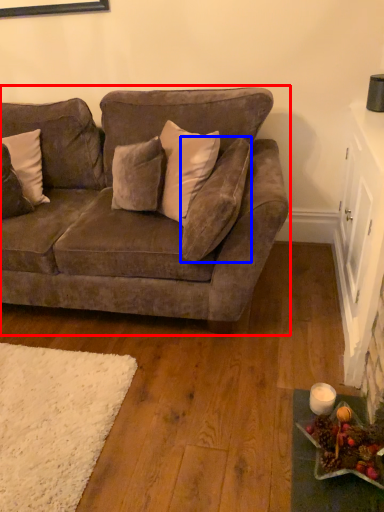
Question: Which of the following is the farthest to the observer, studio couch (highlighted by a red box) or pillow (highlighted by a blue box)?

Choices:
 (A) studio couch
 (B) pillow

Answer: (B)